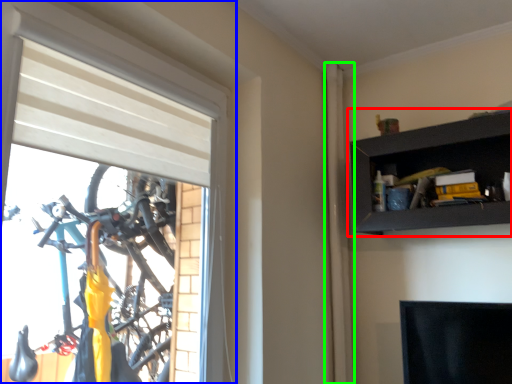
Question: Estimate the real-world distances between objects in this image. Which object is farther from shelf (highlighted by a red box), window (highlighted by a blue box) or curtain (highlighted by a green box)?

Choices:
 (A) window
 (B) curtain

Answer: (A)